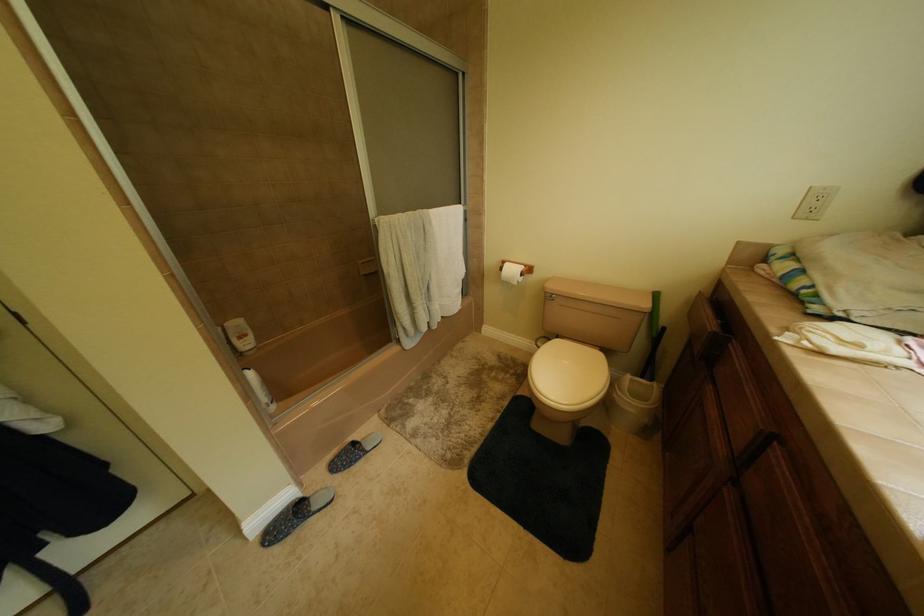
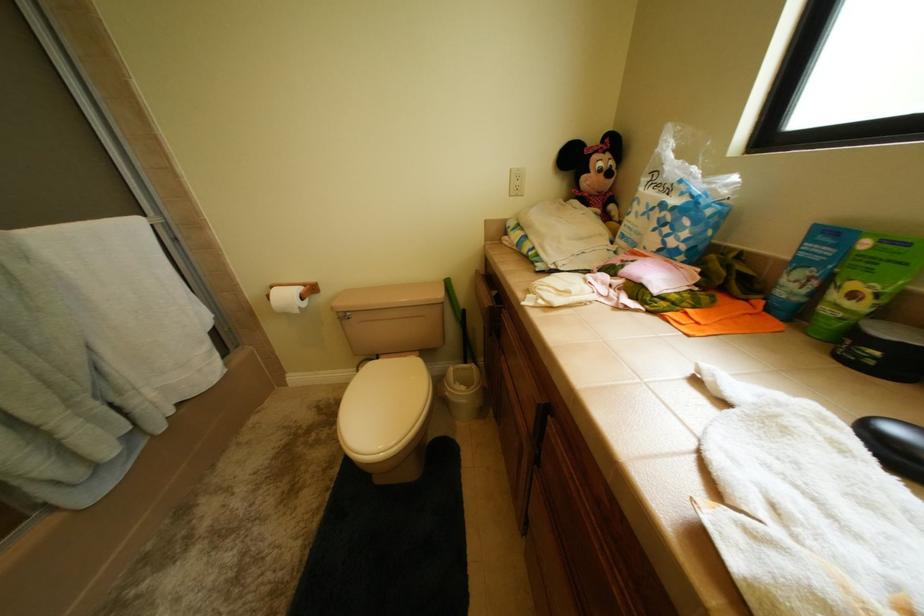
Question: Based on the continuous images, in which direction is the camera rotating? Reply with the corresponding letter.

Choices:
 (A) Left
 (B) Right
 (C) Up
 (D) Down

Answer: (B)